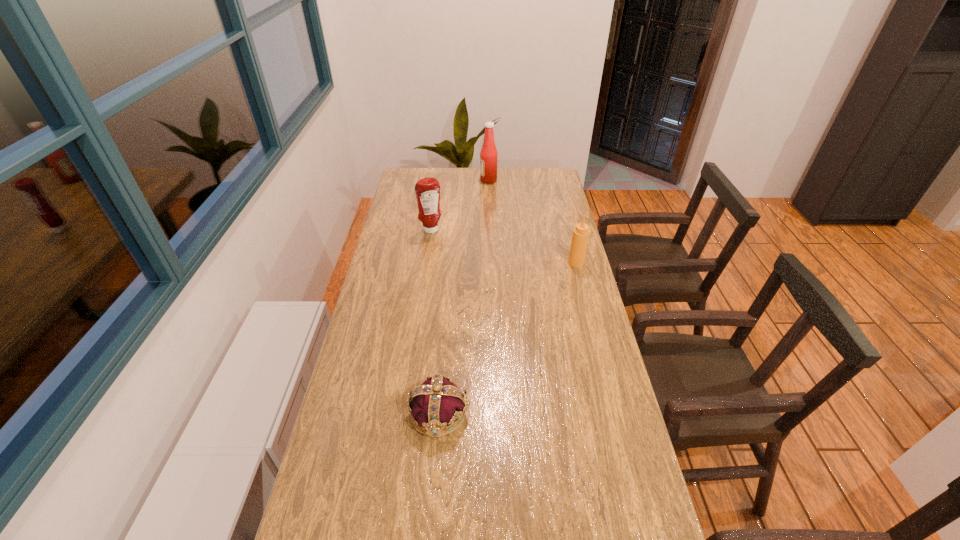
I want to click on object that is the second closest to the second farthest object, so (580, 237).

In order to click on object that is the second closest to the third farthest object in this screenshot , I will do `click(488, 155)`.

Locate an element on the screen. The height and width of the screenshot is (540, 960). the closest condiment to the tallest condiment is located at coordinates (427, 190).

Point out which condiment is positioned as the nearest to the crown. Please provide its 2D coordinates. Your answer should be formatted as a tuple, i.e. [(x, y)], where the tuple contains the x and y coordinates of a point satisfying the conditions above.

[(580, 237)]

Where is `blank space that satisfies the following two spatial constraints: 1. on the front-facing side of the second condiment from right to left; 2. on the right side of the nearest condiment`? blank space that satisfies the following two spatial constraints: 1. on the front-facing side of the second condiment from right to left; 2. on the right side of the nearest condiment is located at coordinates (491, 263).